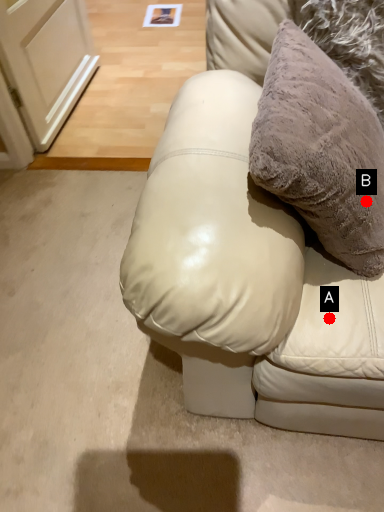
Question: Two points are circled on the image, labeled by A and B beside each circle. Among these points, which one is farthest from the camera?

Choices:
 (A) A is further
 (B) B is further

Answer: (A)